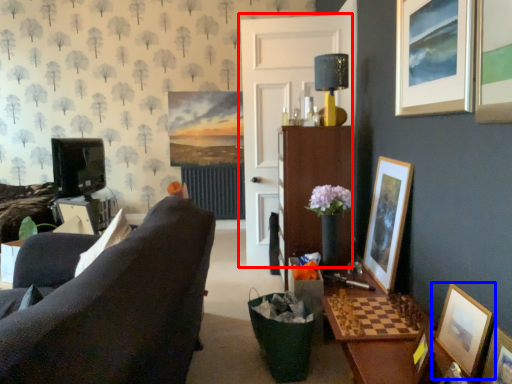
Question: Which object is closer to the camera taking this photo, door (highlighted by a red box) or picture frame (highlighted by a blue box)?

Choices:
 (A) door
 (B) picture frame

Answer: (B)